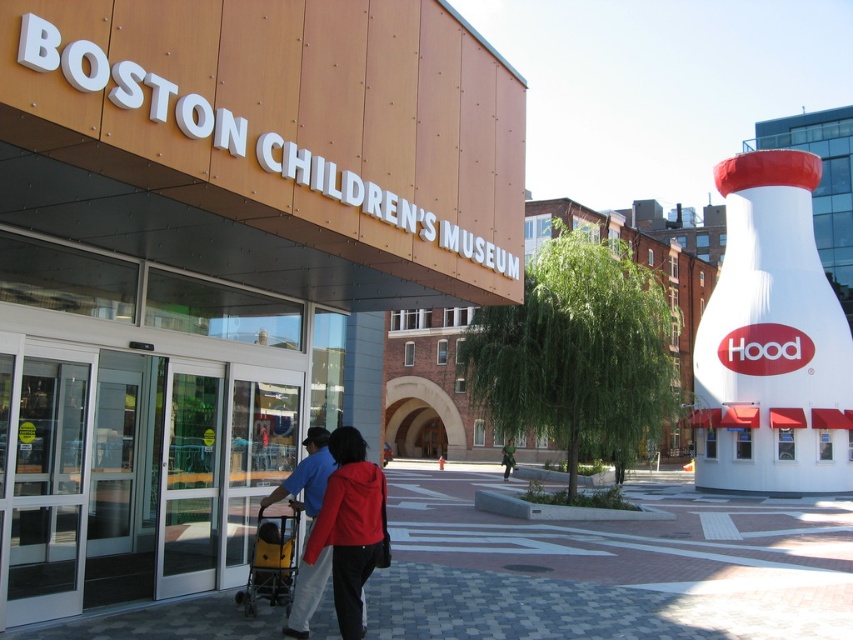
Based on the photo, is matte red jacket at center above matte blue shirt at center?

No.

Can you confirm if matte red jacket at center is positioned below matte blue shirt at center?

Yes, matte red jacket at center is below matte blue shirt at center.

I want to click on matte red jacket at center, so click(x=350, y=525).

Identify the location of matte red jacket at center. (350, 525).

Does matte blue shirt at center come behind yellow plastic baby carriage at lower left?

No, it is in front of yellow plastic baby carriage at lower left.

Consider the image. Who is more forward, (320, 428) or (233, 598)?

Point (320, 428) is more forward.

Is point (293, 483) closer to viewer compared to point (289, 508)?

Yes, point (293, 483) is in front of point (289, 508).

Where is `matte blue shirt at center`? matte blue shirt at center is located at coordinates (306, 476).

Between point (354, 433) and point (280, 593), which one is positioned in front?

Positioned in front is point (354, 433).

Does matte red jacket at center appear under yellow plastic baby carriage at lower left?

No.

Locate an element on the screen. This screenshot has height=640, width=853. matte red jacket at center is located at coordinates (350, 525).